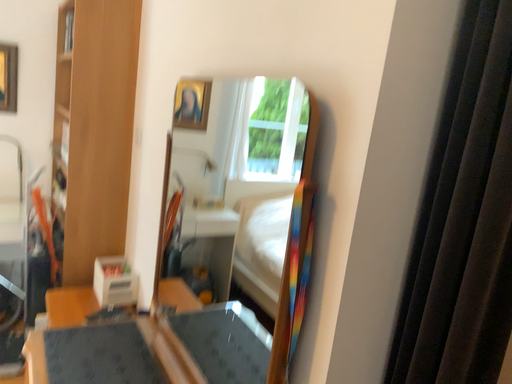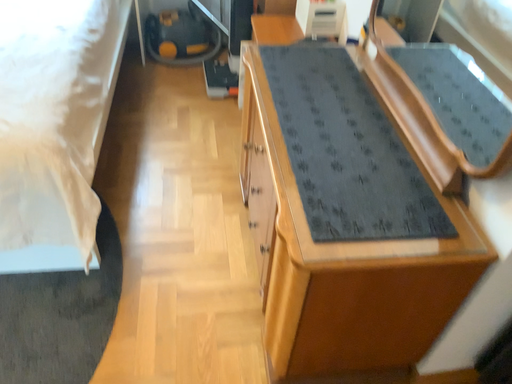
Question: How did the camera likely rotate when shooting the video?

Choices:
 (A) rotated left
 (B) rotated right

Answer: (A)